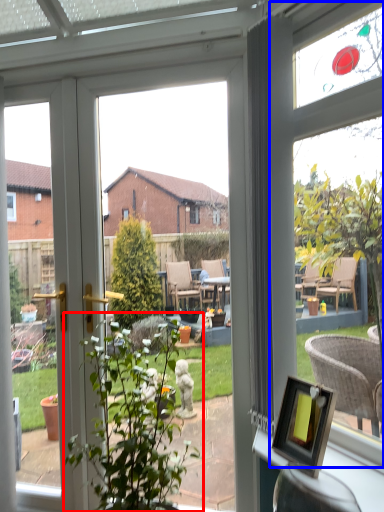
Question: Which object appears closest to the camera in this image, houseplant (highlighted by a red box) or bay window (highlighted by a blue box)?

Choices:
 (A) houseplant
 (B) bay window

Answer: (A)